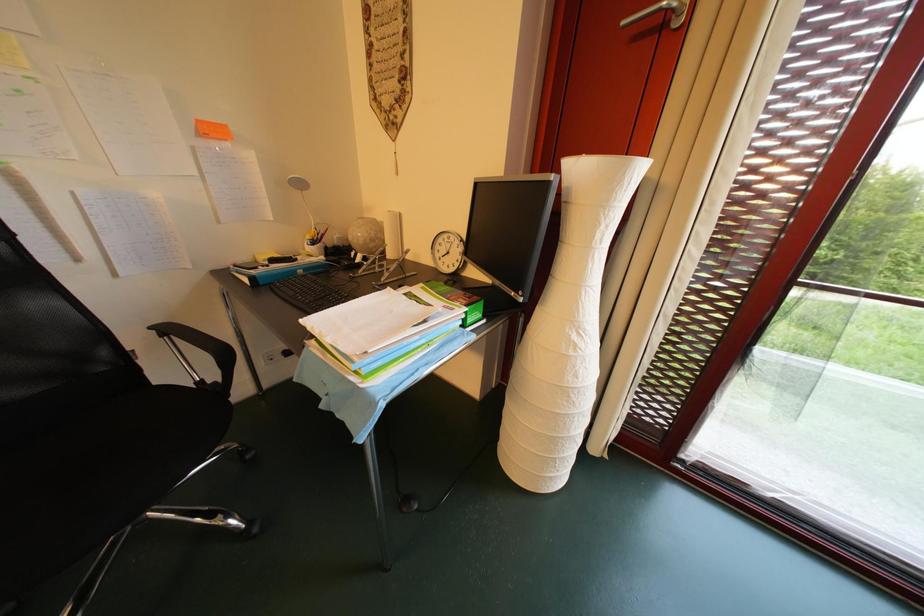
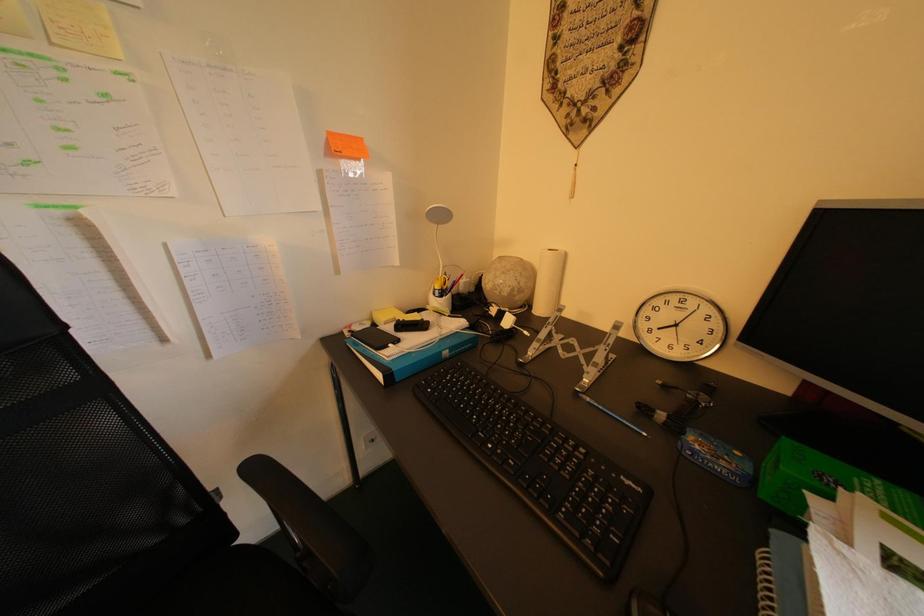
Question: The images are taken continuously from a first-person perspective. In which direction is your viewpoint rotating?

Choices:
 (A) Left
 (B) Right
 (C) Up
 (D) Down

Answer: (A)